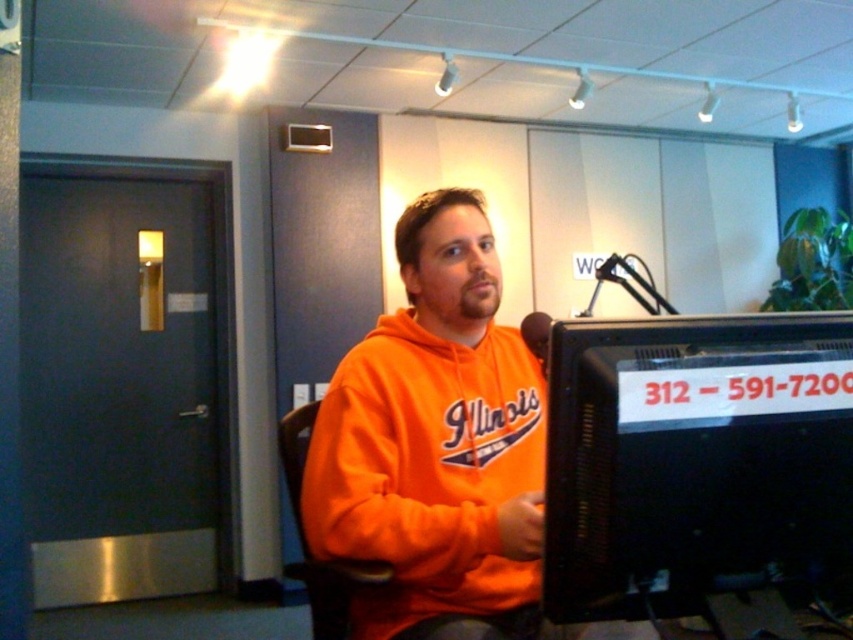
Is orange fleece sweatshirt at center wider than orange fabric swivel chair at center?

Correct, the width of orange fleece sweatshirt at center exceeds that of orange fabric swivel chair at center.

Does orange fleece sweatshirt at center have a smaller size compared to orange fabric swivel chair at center?

No, orange fleece sweatshirt at center is not smaller than orange fabric swivel chair at center.

Find the location of a particular element. orange fleece sweatshirt at center is located at coordinates (434, 444).

Does point (744, 577) come in front of point (294, 499)?

Yes, it is in front of point (294, 499).

Consider the image. Who is more distant from viewer, (677, 596) or (389, 573)?

Positioned behind is point (389, 573).

This screenshot has width=853, height=640. Find the location of `black plastic monitor at right`. black plastic monitor at right is located at coordinates (695, 460).

Is black plastic monitor at right taller than orange fleece sweatshirt at center?

In fact, black plastic monitor at right may be shorter than orange fleece sweatshirt at center.

Which is in front, point (556, 612) or point (520, 554)?

Positioned in front is point (556, 612).

I want to click on black plastic monitor at right, so click(695, 460).